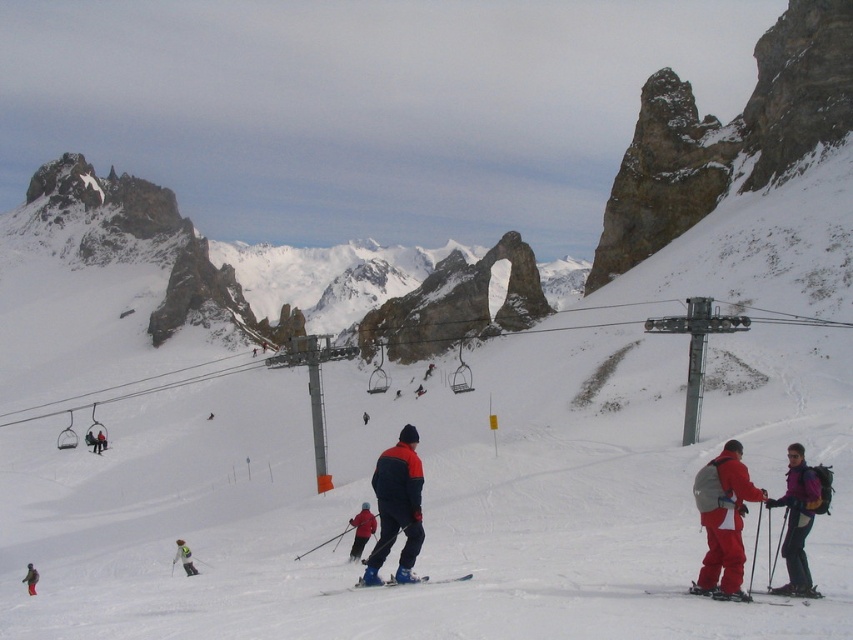
Question: Does red matte ski pants at lower right have a lesser width compared to red ski jacket at center?

Choices:
 (A) yes
 (B) no

Answer: (B)

Question: Can you confirm if pink fabric jacket at lower right is smaller than matte black jacket at left?

Choices:
 (A) no
 (B) yes

Answer: (A)

Question: Is matte red ski at lower right bigger than matte black jacket at left?

Choices:
 (A) no
 (B) yes

Answer: (A)

Question: Among these points, which one is farthest from the camera?

Choices:
 (A) (27, 570)
 (B) (759, 600)

Answer: (A)

Question: Which point is farther to the camera?

Choices:
 (A) red ski suit at lower left
 (B) matte black jacket at left
 (C) matte blue ski suit at center
 (D) blue matte ski at center

Answer: (B)

Question: Which object is farther from the camera taking this photo?

Choices:
 (A) red matte ski pants at lower right
 (B) blue matte ski at center
 (C) red ski jacket at center

Answer: (C)